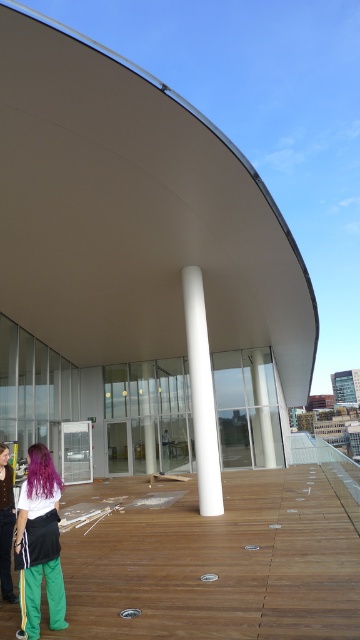
Question: Can you confirm if matte purple hair at lower left is positioned to the left of purple silky hair at lower left?

Choices:
 (A) no
 (B) yes

Answer: (B)

Question: Where is matte purple hair at lower left located in relation to purple silky hair at lower left in the image?

Choices:
 (A) left
 (B) right

Answer: (A)

Question: Which of these objects is positioned closest to the purple silky hair at lower left?

Choices:
 (A) white glossy column at center
 (B) purple hair at center

Answer: (B)

Question: Among these points, which one is nearest to the camera?

Choices:
 (A) (48, 460)
 (B) (62, 589)

Answer: (B)

Question: Does matte purple hair at lower left have a lesser width compared to purple silky hair at lower left?

Choices:
 (A) yes
 (B) no

Answer: (B)

Question: Which object is positioned farthest from the white glossy column at center?

Choices:
 (A) purple silky hair at lower left
 (B) matte purple hair at lower left

Answer: (A)